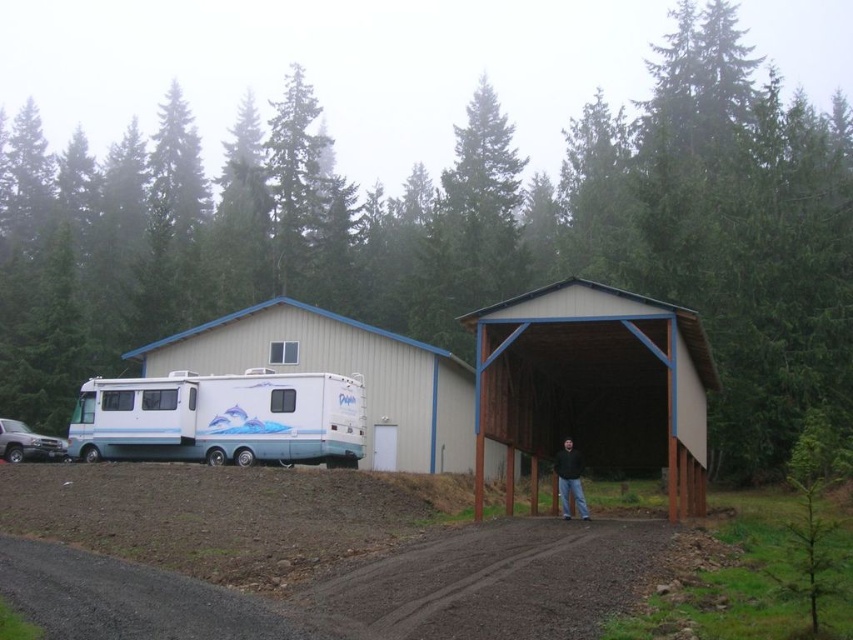
You are driving a delivery truck that is 20 feet long. You need to park your truck on the brown gravel dirt track at center while also ensuring that the white glossy recreational vehicle at left is not blocked. Is there enough space between them to park without blocking the RV?

The brown gravel dirt track at center and white glossy recreational vehicle at left are 52.65 feet apart. Since the truck is 20 feet long, there is sufficient space between them to park without blocking the RV.

Based on the scene, where is the brown wooden shed at center located in terms of coordinates?

The brown wooden shed at center is located at coordinates (595, 384).